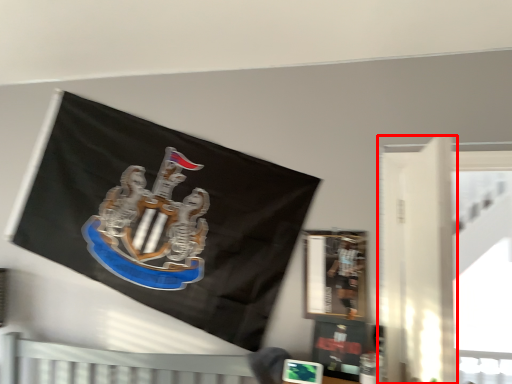
Question: Considering the relative positions of door (annotated by the red box) and person in the image provided, where is door (annotated by the red box) located with respect to the staircase?

Choices:
 (A) right
 (B) left

Answer: (A)